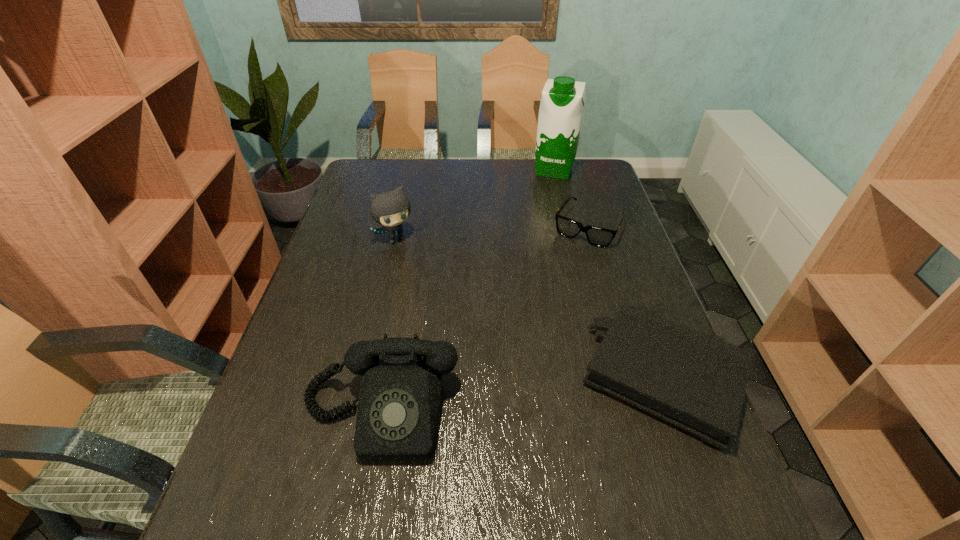
Locate an element on the screen. kitten at the left edge is located at coordinates (391, 208).

What are the coordinates of `Bible at the right edge` in the screenshot? It's located at (697, 382).

Locate an element on the screen. sunglasses that is at the right edge is located at coordinates point(597,236).

Image resolution: width=960 pixels, height=540 pixels. I want to click on soya milk at the right edge, so click(562, 102).

The height and width of the screenshot is (540, 960). Find the location of `object that is at the near left corner`. object that is at the near left corner is located at coordinates (400, 397).

Find the location of `object that is positioned at the far right corner`. object that is positioned at the far right corner is located at coordinates (562, 102).

I want to click on object located in the near right corner section of the desktop, so pos(697,382).

The image size is (960, 540). Find the location of `free space at the far edge of the desktop`. free space at the far edge of the desktop is located at coordinates (504, 174).

Find the location of a particular element. free space at the left edge is located at coordinates (288, 377).

I want to click on vacant space at the right edge of the desktop, so pos(666,421).